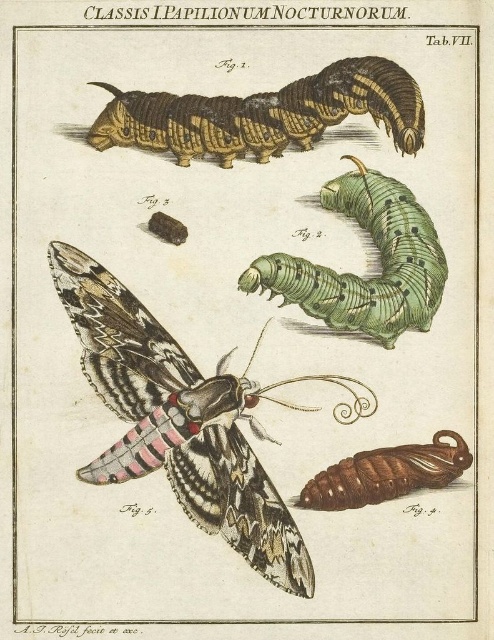
Question: Does brown textured caterpillar at upper left have a greater width compared to brown glossy caterpillar at lower right?

Choices:
 (A) no
 (B) yes

Answer: (B)

Question: Which point is farther to the camera?

Choices:
 (A) speckled brown butterfly at center
 (B) brown glossy caterpillar at lower right
 (C) green matte caterpillar at center

Answer: (C)

Question: Does green matte caterpillar at center have a lesser width compared to brown glossy caterpillar at lower right?

Choices:
 (A) no
 (B) yes

Answer: (A)

Question: Which point appears farthest from the camera in this image?

Choices:
 (A) (322, 285)
 (B) (390, 449)
 (C) (152, 128)
 (D) (247, 417)

Answer: (D)

Question: Considering the real-world distances, which object is farthest from the speckled brown butterfly at center?

Choices:
 (A) green matte caterpillar at center
 (B) brown glossy caterpillar at lower right

Answer: (A)

Question: In this image, where is green matte caterpillar at center located relative to brown glossy caterpillar at lower right?

Choices:
 (A) left
 (B) right

Answer: (A)